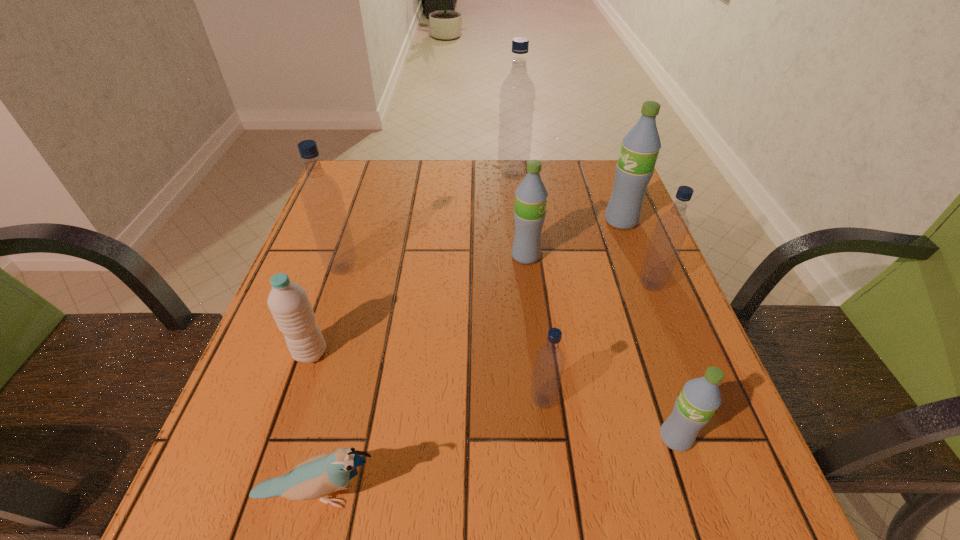
Identify the location of the second nearest water bottle. (549, 364).

I want to click on the seventh farthest object, so click(x=549, y=364).

Image resolution: width=960 pixels, height=540 pixels. Find the location of `the nearest water bottle`. the nearest water bottle is located at coordinates (699, 399).

Locate an element on the screen. This screenshot has width=960, height=540. the second nearest object is located at coordinates (699, 399).

Find the location of a particular element. The width and height of the screenshot is (960, 540). the shortest object is located at coordinates (318, 476).

Where is `the nearest object`? This screenshot has height=540, width=960. the nearest object is located at coordinates (318, 476).

Identify the location of vacant space located on the front of the farthest blue water bottle. (521, 254).

Where is `free space located 0.170m on the back of the second farthest object`? free space located 0.170m on the back of the second farthest object is located at coordinates (604, 177).

At what (x,y) coordinates should I click in order to perform the action: click on vacant space positioned on the front of the second biggest blue water bottle. Please return your answer as a coordinate pair (x, y). Looking at the image, I should click on (x=316, y=346).

At what (x,y) coordinates should I click in order to perform the action: click on vacant space situated 0.300m on the back of the second biggest green water bottle. Please return your answer as a coordinate pair (x, y). The height and width of the screenshot is (540, 960). Looking at the image, I should click on (517, 179).